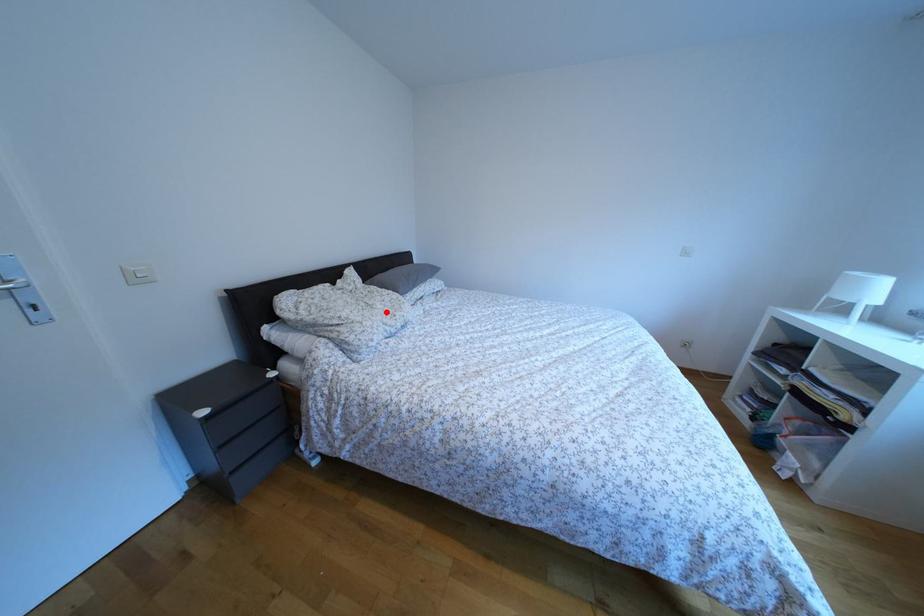
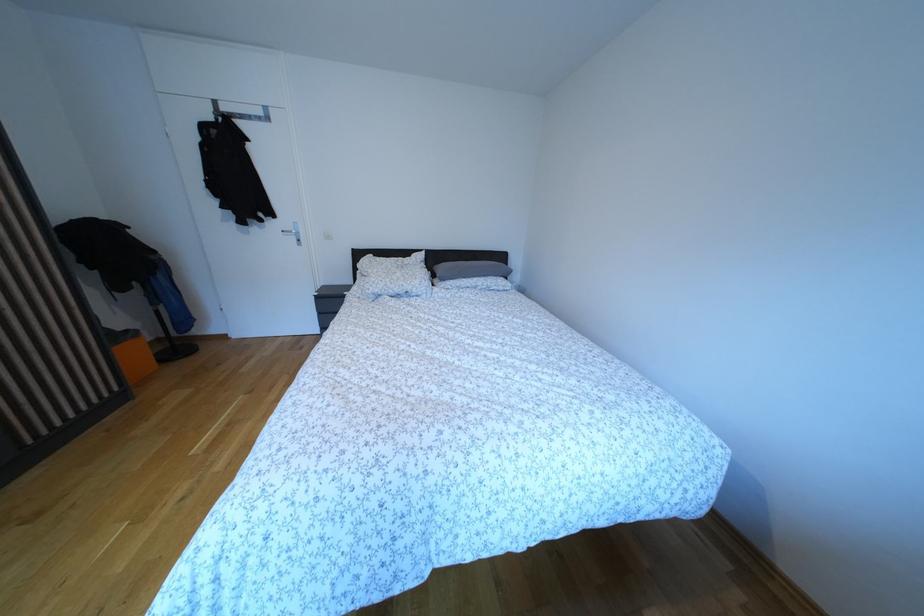
Find the pixel in the second image that matches the highlighted location in the first image.

(406, 281)